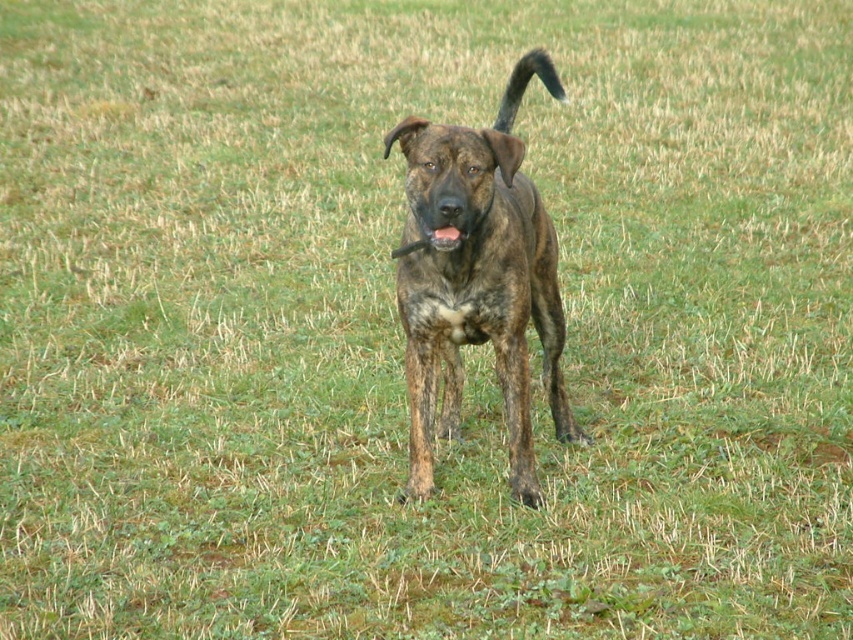
Question: From the image, what is the correct spatial relationship of brindle fur dog at center in relation to brown brindle tail at upper right?

Choices:
 (A) left
 (B) right

Answer: (A)

Question: Does brindle fur dog at center appear over brown brindle dog at center?

Choices:
 (A) yes
 (B) no

Answer: (B)

Question: Which of the following is the closest to the observer?

Choices:
 (A) click(x=432, y=234)
 (B) click(x=421, y=316)
 (C) click(x=544, y=49)

Answer: (A)

Question: Which point appears closest to the camera in this image?

Choices:
 (A) (451, 237)
 (B) (538, 58)
 (C) (535, 224)

Answer: (A)

Question: Which point is farther to the camera?

Choices:
 (A) brown brindle tail at upper right
 (B) brindle fur dog at center
 (C) brown brindle dog at center

Answer: (A)

Question: Observing the image, what is the correct spatial positioning of brindle fur dog at center in reference to brown brindle dog at center?

Choices:
 (A) left
 (B) right

Answer: (B)